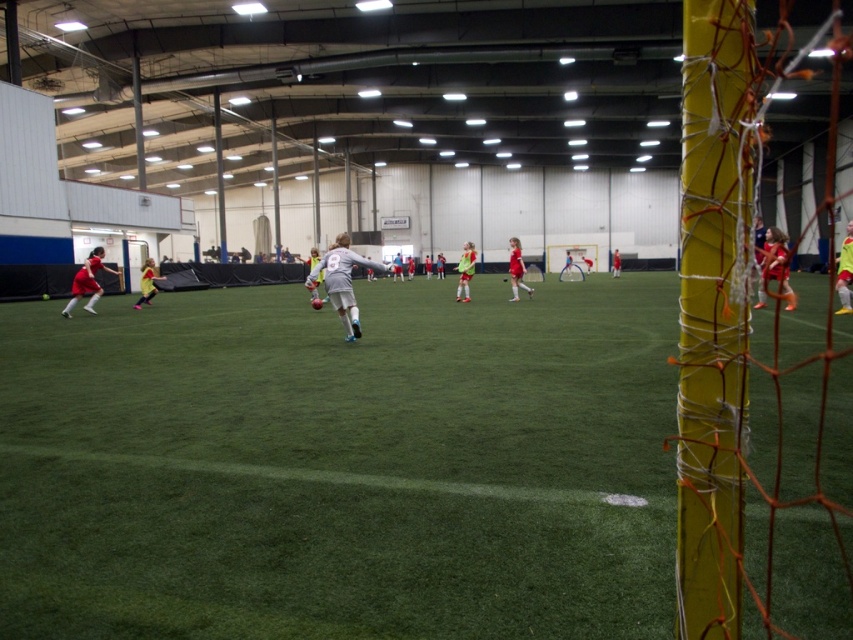
Question: Can you confirm if matte red jersey at right is positioned to the left of matte red jersey at left?

Choices:
 (A) no
 (B) yes

Answer: (A)

Question: Which point is closer to the camera taking this photo?

Choices:
 (A) (514, 288)
 (B) (357, 307)

Answer: (B)

Question: Can you confirm if matte red jersey at left is wider than matte red jersey at center?

Choices:
 (A) no
 (B) yes

Answer: (B)

Question: Which of these objects is positioned farthest from the yellow jersey at left?

Choices:
 (A) matte red jersey at right
 (B) yellow-green jersey at center

Answer: (A)

Question: Does matte red jersey at right have a larger size compared to matte red jersey at center?

Choices:
 (A) yes
 (B) no

Answer: (B)

Question: Which point is closer to the camera?

Choices:
 (A) (152, 292)
 (B) (335, 248)

Answer: (B)